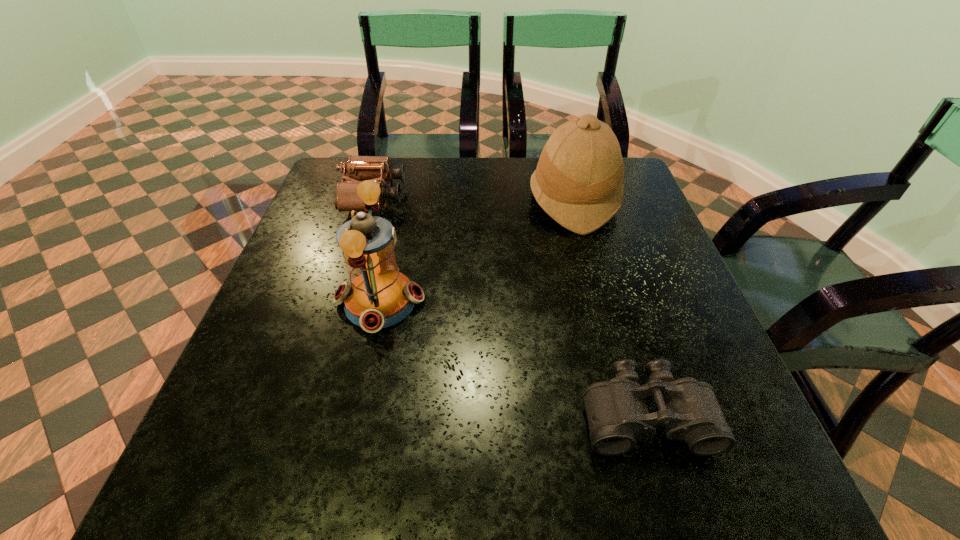
What are the coordinates of `object that is at the near right corner` in the screenshot? It's located at (617, 414).

I want to click on vacant space at the far edge of the desktop, so click(x=505, y=164).

In the image, there is a desktop. Identify the location of free region at the near edge. The image size is (960, 540). (518, 471).

You are a GUI agent. You are given a task and a screenshot of the screen. Output one action in this format:
    pyautogui.click(x=<x>, y=<y>)
    Task: Click on the free region at the left edge of the desktop
    This screenshot has width=960, height=540.
    Given the screenshot: What is the action you would take?
    pyautogui.click(x=298, y=318)

Image resolution: width=960 pixels, height=540 pixels. In the image, there is a desktop. Find the location of `vacant region at the right edge`. vacant region at the right edge is located at coordinates (723, 409).

The width and height of the screenshot is (960, 540). What are the coordinates of `blank region between the lantern and the right binoculars` in the screenshot? It's located at (513, 359).

Where is `free space between the left binoculars and the hat`? free space between the left binoculars and the hat is located at coordinates (474, 199).

The image size is (960, 540). I want to click on free space between the lantern and the hat, so click(477, 251).

Find the location of a particular element. free point between the left binoculars and the shortest object is located at coordinates (510, 306).

Locate an element on the screen. The image size is (960, 540). vacant space in between the third tallest object and the hat is located at coordinates (474, 199).